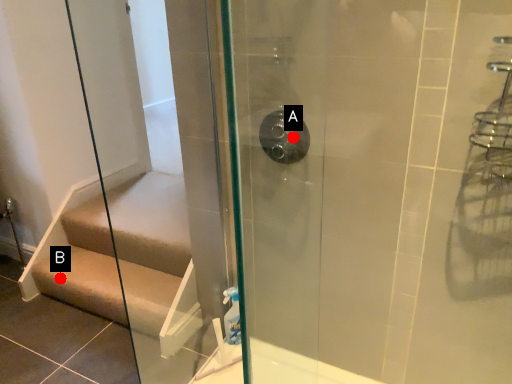
Question: Two points are circled on the image, labeled by A and B beside each circle. Which of the following is the farthest from the observer?

Choices:
 (A) A is further
 (B) B is further

Answer: (B)